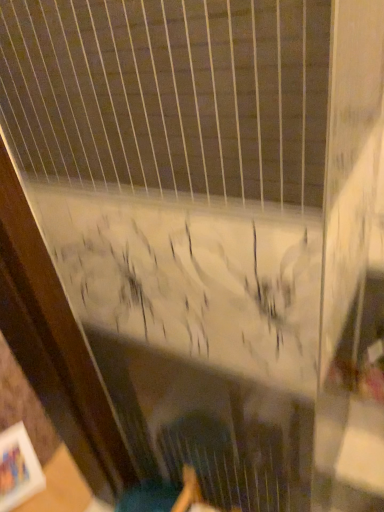
The height and width of the screenshot is (512, 384). Describe the element at coordinates (18, 468) in the screenshot. I see `white matte picture frame at lower left` at that location.

The width and height of the screenshot is (384, 512). Identify the location of white matte picture frame at lower left. (18, 468).

Identify the location of white matte picture frame at lower left. (18, 468).